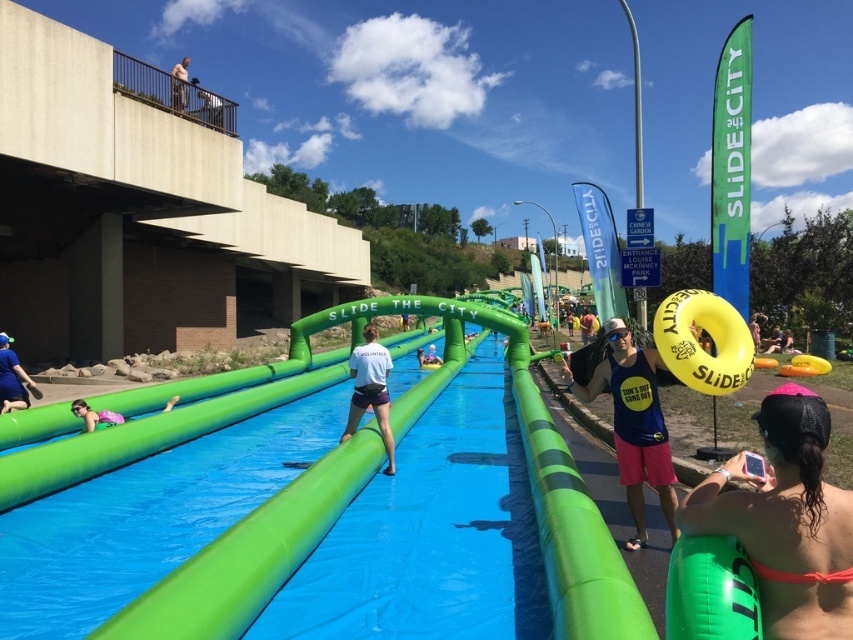
You are organizing a beach cleanup and need to collect all pink fabric items. You see a pink fabric bikini at lower right and a pink fabric at lower left. Which item should you collect first if you want to start with the larger one?

The pink fabric at lower left should be collected first because it occupies more space than the pink fabric bikini at lower right.

What is the color of the fabric at the point with coordinates (633, 422)?

The point at coordinates (633, 422) is on a blue fabric tank top at center.

You are a photographer at the event and want to capture both the pink fabric bikini at lower right and the pink fabric at lower left in a single frame. Based on their positions, which side of the slide should you position yourself to ensure both are visible?

To capture both the pink fabric bikini at lower right and the pink fabric at lower left in a single frame, you should position yourself to the left side of the slide. Since the pink fabric bikini at lower right is to the right of the pink fabric at lower left, positioning yourself to the left would allow you to see both objects within the frame.